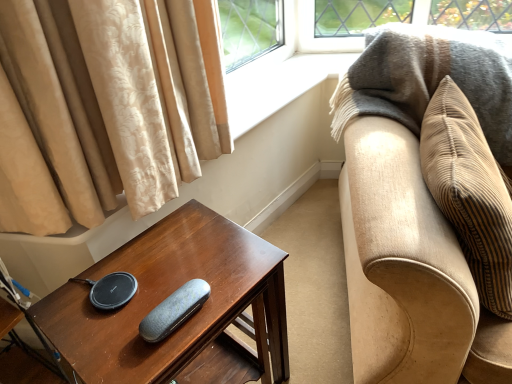
Image resolution: width=512 pixels, height=384 pixels. Identify the location of dark brown wood table at lower left. (167, 296).

The width and height of the screenshot is (512, 384). Describe the element at coordinates (174, 310) in the screenshot. I see `textured gray case at center` at that location.

Identify the location of beige corduroy pillow at right. The width and height of the screenshot is (512, 384). (470, 192).

At what (x,y) coordinates should I click in order to perform the action: click on dark brown wood table at lower left. Please return your answer as a coordinate pair (x, y). Looking at the image, I should click on (167, 296).

From a real-world perspective, who is located higher, dark brown wood table at lower left or beige corduroy pillow at right?

beige corduroy pillow at right, from a real-world perspective.

Does dark brown wood table at lower left appear on the left side of beige corduroy pillow at right?

Indeed, dark brown wood table at lower left is positioned on the left side of beige corduroy pillow at right.

Based on the photo, is dark brown wood table at lower left facing towards beige corduroy pillow at right?

No, dark brown wood table at lower left is not facing towards beige corduroy pillow at right.

I want to click on pillow above the dark brown wood table at lower left (from a real-world perspective), so click(x=470, y=192).

Is beige corduroy couch at right aimed at dark brown wood table at lower left?

No, beige corduroy couch at right does not turn towards dark brown wood table at lower left.

Which is closer, [488,353] or [216,285]?

The point [488,353] is closer to the camera.

In the scene shown: From the image's perspective, is beige corduroy couch at right located above dark brown wood table at lower left?

→ Yes.

From a real-world perspective, is beige corduroy couch at right over dark brown wood table at lower left?

Yes, from a real-world perspective, beige corduroy couch at right is on top of dark brown wood table at lower left.

From the image's perspective, which object appears higher, beige corduroy pillow at right or dark brown wood table at lower left?

beige corduroy pillow at right, from the image's perspective.

Relative to dark brown wood table at lower left, is beige corduroy pillow at right in front or behind?

Clearly, beige corduroy pillow at right is in front of dark brown wood table at lower left.

Measure the distance between beige corduroy pillow at right and dark brown wood table at lower left.

A distance of 20.68 inches exists between beige corduroy pillow at right and dark brown wood table at lower left.

Do you think beige corduroy pillow at right is within dark brown wood table at lower left, or outside of it?

beige corduroy pillow at right cannot be found inside dark brown wood table at lower left.

Is textured gray case at center taller than beige corduroy pillow at right?

Incorrect, the height of textured gray case at center is not larger of that of beige corduroy pillow at right.

Locate an element on the screen. pad on the left of beige corduroy pillow at right is located at coordinates (174, 310).

Are textured gray case at center and beige corduroy pillow at right located far from each other?

No, textured gray case at center is not far away from beige corduroy pillow at right.

Is textured gray case at center turned away from beige corduroy pillow at right?

That's not correct — textured gray case at center is not looking away from beige corduroy pillow at right.

Does beige corduroy pillow at right lie in front of textured gray case at center?

Yes, beige corduroy pillow at right is closer to the camera.

Which is further, (453, 130) or (190, 280)?

The point (453, 130) is farther.

Considering the relative sizes of beige corduroy pillow at right and textured gray case at center in the image provided, is beige corduroy pillow at right taller than textured gray case at center?

Yes.

In the scene shown: From a real-world perspective, which object stands above the other?

textured gray case at center.

Based on their positions, is beige corduroy couch at right located to the left or right of textured gray case at center?

In the image, beige corduroy couch at right appears on the right side of textured gray case at center.

Based on the photo, is beige corduroy couch at right inside or outside of textured gray case at center?

beige corduroy couch at right exists outside the volume of textured gray case at center.

From their relative heights in the image, would you say beige corduroy couch at right is taller or shorter than textured gray case at center?

In the image, beige corduroy couch at right appears to be taller than textured gray case at center.

Is dark brown wood table at lower left turned away from textured gray case at center?

That's not correct — dark brown wood table at lower left is not looking away from textured gray case at center.

From a real-world perspective, between dark brown wood table at lower left and textured gray case at center, who is vertically lower?

dark brown wood table at lower left, from a real-world perspective.

Between dark brown wood table at lower left and textured gray case at center, which one has smaller size?

textured gray case at center.

Image resolution: width=512 pixels, height=384 pixels. In the image, there is a beige corduroy pillow at right. Find the location of `table below it (from the image's perspective)`. table below it (from the image's perspective) is located at coordinates (167, 296).

Identify the location of studio couch located above the dark brown wood table at lower left (from a real-world perspective). The height and width of the screenshot is (384, 512). 415,208.

Considering their positions, is beige corduroy couch at right positioned further to beige corduroy pillow at right than dark brown wood table at lower left?

Among the two, dark brown wood table at lower left is located further to beige corduroy pillow at right.

When comparing their distances from dark brown wood table at lower left, does textured gray case at center or beige corduroy couch at right seem closer?

Based on the image, textured gray case at center appears to be nearer to dark brown wood table at lower left.

Looking at the image, which one is located closer to textured gray case at center, beige corduroy couch at right or dark brown wood table at lower left?

dark brown wood table at lower left.

When comparing their distances from textured gray case at center, does dark brown wood table at lower left or beige corduroy couch at right seem closer?

dark brown wood table at lower left is closer to textured gray case at center.

Considering their positions, is beige corduroy pillow at right positioned closer to dark brown wood table at lower left than textured gray case at center?

textured gray case at center is closer to dark brown wood table at lower left.

Looking at this image, which object lies further to the anchor point textured gray case at center, beige corduroy couch at right or beige corduroy pillow at right?

beige corduroy pillow at right lies further to textured gray case at center than the other object.

Which object lies nearer to the anchor point dark brown wood table at lower left, textured gray case at center or beige corduroy pillow at right?

textured gray case at center.

When comparing their distances from beige corduroy couch at right, does textured gray case at center or dark brown wood table at lower left seem further?

textured gray case at center is further to beige corduroy couch at right.

Image resolution: width=512 pixels, height=384 pixels. Find the location of `pillow between dark brown wood table at lower left and beige corduroy couch at right from left to right`. pillow between dark brown wood table at lower left and beige corduroy couch at right from left to right is located at coordinates (470, 192).

Find the location of a particular element. pillow between textured gray case at center and beige corduroy couch at right from left to right is located at coordinates (470, 192).

I want to click on pad situated between dark brown wood table at lower left and beige corduroy pillow at right from left to right, so click(174, 310).

What are the coordinates of `pad between dark brown wood table at lower left and beige corduroy couch at right` in the screenshot? It's located at (174, 310).